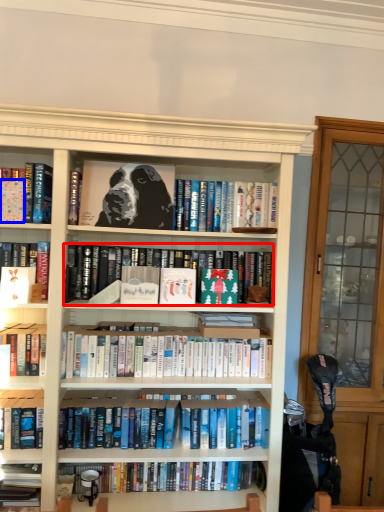
Question: Which object is further to the camera taking this photo, book (highlighted by a red box) or paperback book (highlighted by a blue box)?

Choices:
 (A) book
 (B) paperback book

Answer: (A)